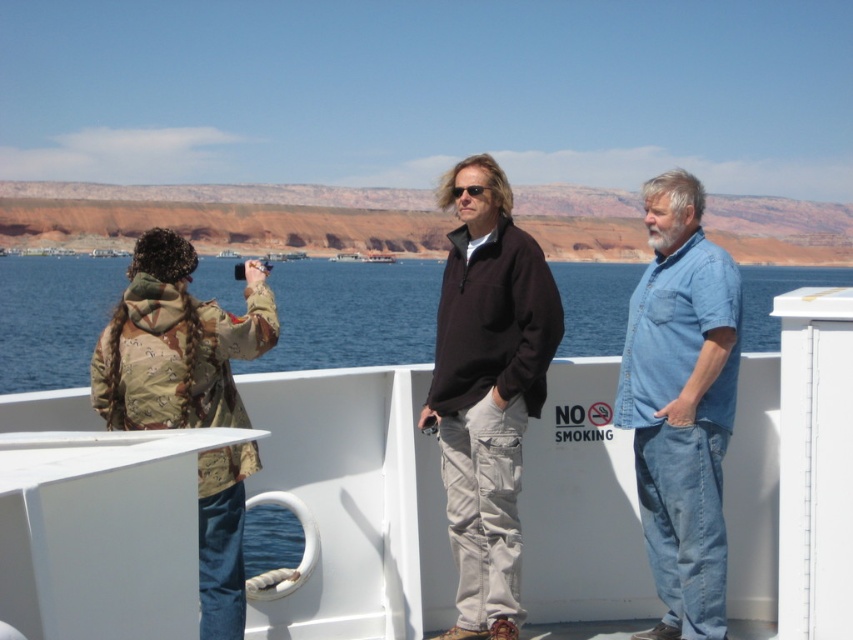
Question: Which point is farther to the camera?

Choices:
 (A) white matte boat at center
 (B) dark brown fleece at center
 (C) camouflage jacket at left

Answer: (A)

Question: Is white matte boat at center positioned at the back of blue water at center?

Choices:
 (A) no
 (B) yes

Answer: (B)

Question: Can you confirm if white matte boat at center is positioned to the right of blue denim shirt at right?

Choices:
 (A) no
 (B) yes

Answer: (A)

Question: Which object is closer to the camera taking this photo?

Choices:
 (A) dark brown fleece at center
 (B) camouflage jacket at left
 (C) blue water at center
 (D) blue denim shirt at right

Answer: (B)

Question: Does blue denim shirt at right appear on the left side of camouflage jacket at left?

Choices:
 (A) no
 (B) yes

Answer: (A)

Question: Which point appears farthest from the camera in this image?

Choices:
 (A) (488, 180)
 (B) (672, 339)
 (C) (281, 500)
 (D) (134, 292)

Answer: (A)